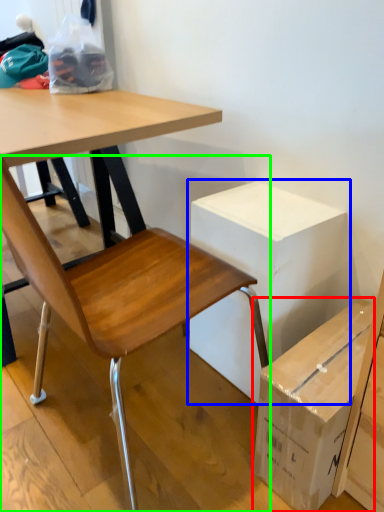
Question: Considering the real-world distances, which object is closest to box (highlighted by a red box)? cardboard box (highlighted by a blue box) or chair (highlighted by a green box).

Choices:
 (A) cardboard box
 (B) chair

Answer: (A)